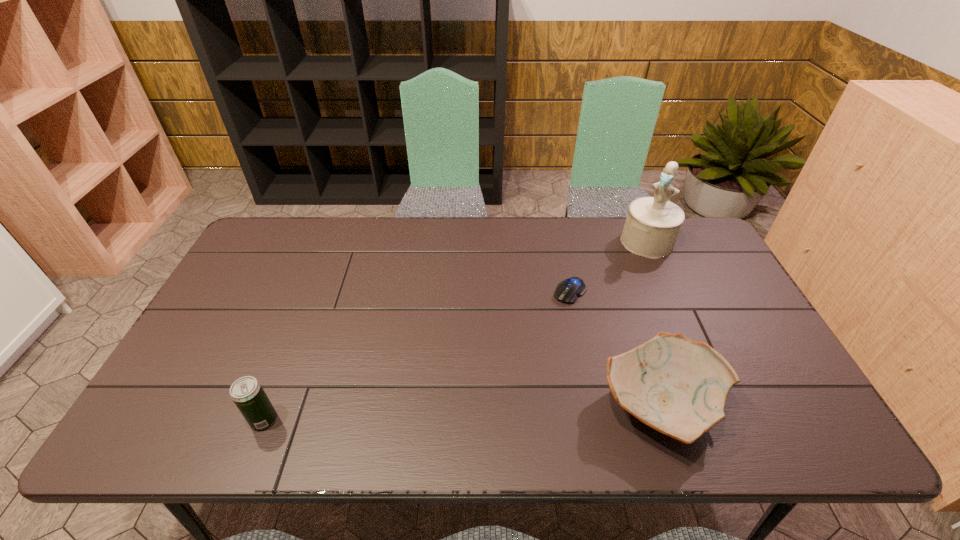
Where is `vacant space on the desktop that is between the beer can and the pottery and is positioned at the beak of the figurine`? This screenshot has height=540, width=960. vacant space on the desktop that is between the beer can and the pottery and is positioned at the beak of the figurine is located at coordinates (515, 411).

Locate an element on the screen. free space on the desktop that is between the beer can and the pottery and is positioned on the button side of the shortest object is located at coordinates (451, 414).